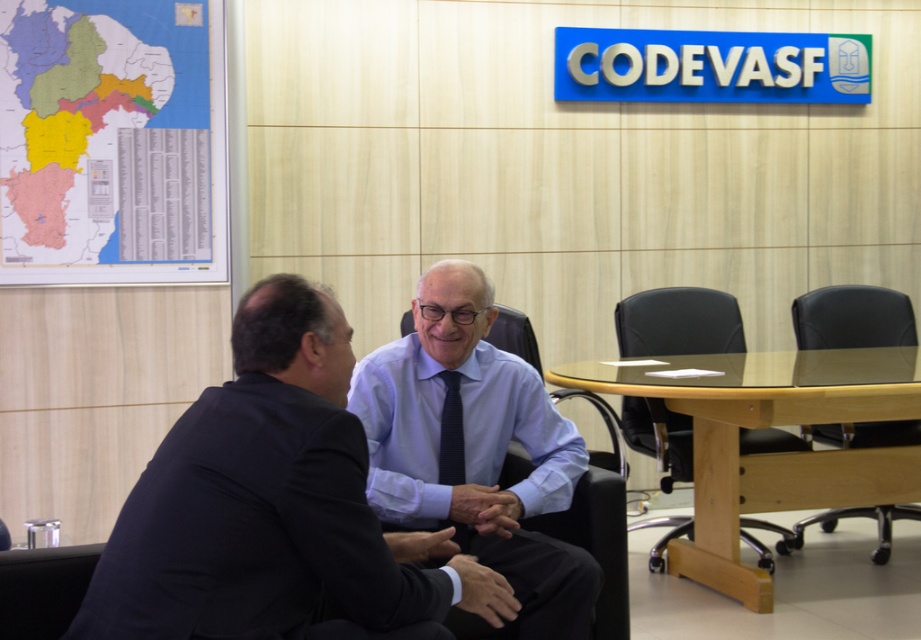
Question: Which point is closer to the camera?

Choices:
 (A) (442, 440)
 (B) (801, 522)
 (C) (624, 433)
 (D) (30, 589)

Answer: (D)

Question: Does light blue shirt at center have a lesser width compared to black leather chair at right?

Choices:
 (A) yes
 (B) no

Answer: (B)

Question: Which of the following is the farthest from the observer?

Choices:
 (A) light blue shirt at center
 (B) matte black suit at center
 (C) dark blue fabric chair at lower left

Answer: (A)

Question: Which point appears closest to the camera in this image?

Choices:
 (A) (895, 492)
 (B) (801, 525)
 (C) (579, 625)

Answer: (C)

Question: Is the position of light blue shirt at center more distant than that of black leather chair at right?

Choices:
 (A) yes
 (B) no

Answer: (B)

Question: Can you confirm if matte black suit at center is positioned to the left of black leather chair at center?

Choices:
 (A) no
 (B) yes

Answer: (B)